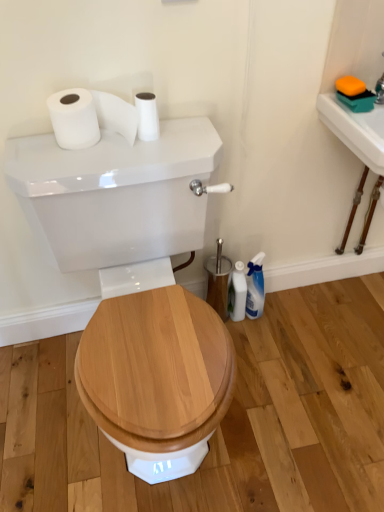
The image size is (384, 512). Find the location of `vacant space in front of white matte toilet paper at upper center, which is counted as the second toilet paper, starting from the left`. vacant space in front of white matte toilet paper at upper center, which is counted as the second toilet paper, starting from the left is located at coordinates (133, 157).